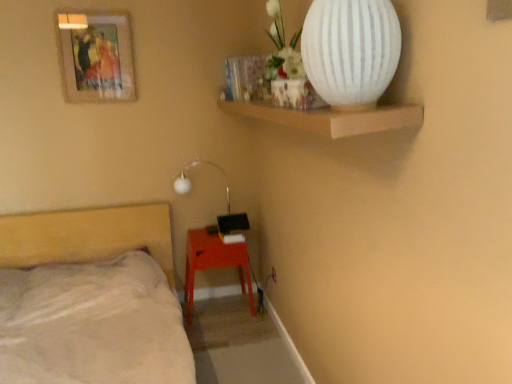
What is the approximate height of beige fabric bed at lower left?

The height of beige fabric bed at lower left is 77.62 centimeters.

What is the approximate height of wooden framed artwork at upper left?

wooden framed artwork at upper left is 21.06 inches tall.

Find the location of `white matte vase at upper right`. white matte vase at upper right is located at coordinates (351, 51).

Find the location of a particular element. The image size is (512, 384). matte orange table at lower center is located at coordinates (214, 264).

Locate an element on the screen. Image resolution: width=512 pixels, height=384 pixels. beige fabric bed at lower left is located at coordinates (91, 299).

From a real-world perspective, is wooden framed artwork at upper left positioned above or below white plastic electric outlet at lower center?

wooden framed artwork at upper left is situated higher than white plastic electric outlet at lower center in the real world.

Find the location of a particular element. This screenshot has width=512, height=384. electric outlet located on the right of wooden framed artwork at upper left is located at coordinates [273, 274].

From the image's perspective, which one is positioned higher, wooden framed artwork at upper left or white plastic electric outlet at lower center?

wooden framed artwork at upper left, from the image's perspective.

In the scene shown: Is wooden framed artwork at upper left to the left or to the right of white plastic electric outlet at lower center in the image?

Clearly, wooden framed artwork at upper left is on the left of white plastic electric outlet at lower center in the image.

From the image's perspective, which object appears higher, white matte lamp at upper center or wooden framed artwork at upper left?

From the image's view, wooden framed artwork at upper left is above.

Could you tell me if white matte lamp at upper center is turned towards wooden framed artwork at upper left?

No, white matte lamp at upper center does not turn towards wooden framed artwork at upper left.

Is white matte lamp at upper center outside of wooden framed artwork at upper left?

white matte lamp at upper center lies outside wooden framed artwork at upper left's area.

Are white matte lamp at upper center and wooden framed artwork at upper left far apart?

No, white matte lamp at upper center is not far from wooden framed artwork at upper left.

Is wooden framed artwork at upper left closer to camera compared to matte orange table at lower center?

Yes, wooden framed artwork at upper left is closer to the viewer.

Which of these two, wooden framed artwork at upper left or matte orange table at lower center, is thinner?

wooden framed artwork at upper left is thinner.

From the image's perspective, which is above, wooden framed artwork at upper left or matte orange table at lower center?

wooden framed artwork at upper left, from the image's perspective.

Is white plastic electric outlet at lower center completely or partially outside of wooden framed artwork at upper left?

white plastic electric outlet at lower center lies outside wooden framed artwork at upper left's area.

From the image's perspective, which object appears higher, white plastic electric outlet at lower center or wooden framed artwork at upper left?

wooden framed artwork at upper left appears higher in the image.

This screenshot has width=512, height=384. What are the coordinates of `picture frame on the left of the white plastic electric outlet at lower center` in the screenshot? It's located at (97, 59).

Could you tell me if white plastic electric outlet at lower center is turned towards wooden framed artwork at upper left?

No, white plastic electric outlet at lower center does not turn towards wooden framed artwork at upper left.

Considering the positions of points (351, 39) and (189, 281), is point (351, 39) closer to camera compared to point (189, 281)?

Yes.

Where is `nightstand to the left of white matte vase at upper right`? nightstand to the left of white matte vase at upper right is located at coordinates (214, 264).

From the picture: Is matte orange table at lower center a part of white matte vase at upper right?

No.

In the scene shown: From a real-world perspective, who is located higher, white matte vase at upper right or matte orange table at lower center?

white matte vase at upper right, from a real-world perspective.

In the image, there is a wooden framed artwork at upper left. Identify the location of vase below it (from the image's perspective). The image size is (512, 384). (351, 51).

Choose the correct answer: Is wooden framed artwork at upper left inside white matte vase at upper right or outside it?

The correct answer is: outside.

From the picture: Is wooden framed artwork at upper left facing towards white matte vase at upper right?

No, wooden framed artwork at upper left is not aimed at white matte vase at upper right.

From the picture: Is white matte lamp at upper center smaller than white plastic electric outlet at lower center?

Actually, white matte lamp at upper center might be larger than white plastic electric outlet at lower center.

Relative to white plastic electric outlet at lower center, is white matte lamp at upper center in front or behind?

white matte lamp at upper center is positioned farther from the viewer than white plastic electric outlet at lower center.

Is white matte lamp at upper center taller than white plastic electric outlet at lower center?

Yes.

Measure the distance between white matte lamp at upper center and white plastic electric outlet at lower center.

white matte lamp at upper center is 31.18 inches from white plastic electric outlet at lower center.

Locate an element on the screen. The height and width of the screenshot is (384, 512). picture frame lying on the left of white plastic electric outlet at lower center is located at coordinates (97, 59).

Find the location of `lamp directly beneath the wooden framed artwork at upper left (from a real-world perspective)`. lamp directly beneath the wooden framed artwork at upper left (from a real-world perspective) is located at coordinates (191, 183).

Estimate the real-world distances between objects in this image. Which object is closer to white matte lamp at upper center, white matte vase at upper right or matte orange table at lower center?

The object closer to white matte lamp at upper center is matte orange table at lower center.

Consider the image. Estimate the real-world distances between objects in this image. Which object is further from white matte vase at upper right, beige fabric bed at lower left or wooden framed artwork at upper left?

Among the two, wooden framed artwork at upper left is located further to white matte vase at upper right.

Which object lies nearer to the anchor point white matte lamp at upper center, white matte vase at upper right or wooden framed artwork at upper left?

Based on the image, wooden framed artwork at upper left appears to be nearer to white matte lamp at upper center.

Looking at the image, which one is located closer to wooden framed artwork at upper left, white plastic electric outlet at lower center or beige fabric bed at lower left?

The object closer to wooden framed artwork at upper left is beige fabric bed at lower left.

When comparing their distances from white plastic electric outlet at lower center, does wooden framed artwork at upper left or white matte vase at upper right seem closer?

wooden framed artwork at upper left is positioned closer to the anchor white plastic electric outlet at lower center.

Considering their positions, is white matte lamp at upper center positioned closer to white matte vase at upper right than white plastic electric outlet at lower center?

Among the two, white plastic electric outlet at lower center is located nearer to white matte vase at upper right.

Estimate the real-world distances between objects in this image. Which object is closer to matte orange table at lower center, wooden framed artwork at upper left or white matte lamp at upper center?

The object closer to matte orange table at lower center is white matte lamp at upper center.

From the image, which object appears to be nearer to white matte vase at upper right, white matte lamp at upper center or beige fabric bed at lower left?

beige fabric bed at lower left is positioned closer to the anchor white matte vase at upper right.

The width and height of the screenshot is (512, 384). Find the location of `vase between beige fabric bed at lower left and white plastic electric outlet at lower center in the front-back direction`. vase between beige fabric bed at lower left and white plastic electric outlet at lower center in the front-back direction is located at coordinates [351, 51].

You are a GUI agent. You are given a task and a screenshot of the screen. Output one action in this format:
    pyautogui.click(x=<x>, y=<y>)
    Task: Click on the electric outlet that lies between wooden framed artwork at upper left and matte orange table at lower center from top to bottom
    The width and height of the screenshot is (512, 384).
    Given the screenshot: What is the action you would take?
    pyautogui.click(x=273, y=274)

The height and width of the screenshot is (384, 512). Find the location of `vase positioned between beige fabric bed at lower left and wooden framed artwork at upper left from near to far`. vase positioned between beige fabric bed at lower left and wooden framed artwork at upper left from near to far is located at coordinates (351, 51).

I want to click on picture frame located between white matte vase at upper right and white plastic electric outlet at lower center in the depth direction, so click(x=97, y=59).